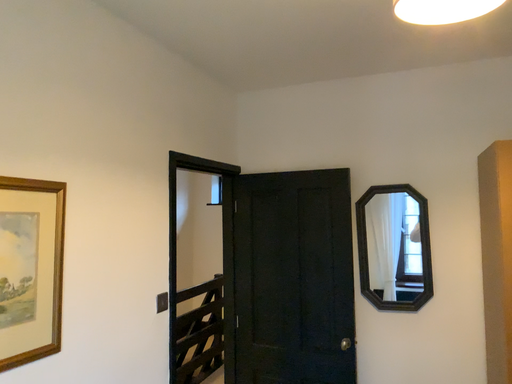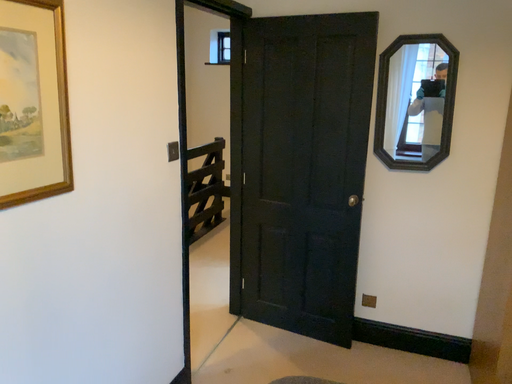
Question: Which way did the camera rotate in the video?

Choices:
 (A) rotated downward
 (B) rotated upward

Answer: (A)